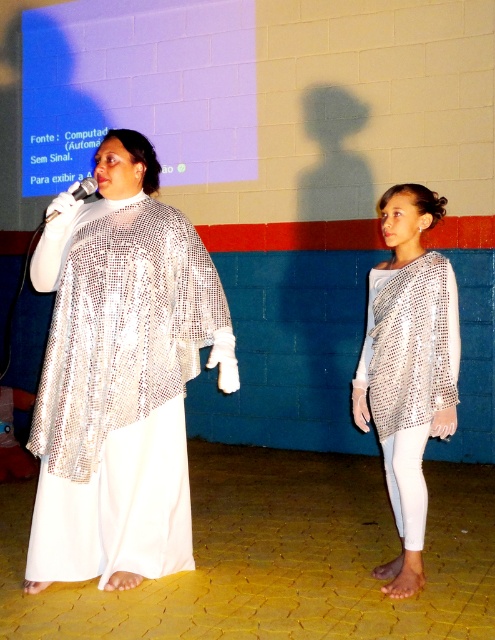
Is shiny metallic robe at left further to the viewer compared to silver mesh top at center?

No, shiny metallic robe at left is in front of silver mesh top at center.

Is shiny metallic robe at left thinner than silver mesh top at center?

No, shiny metallic robe at left is not thinner than silver mesh top at center.

Locate an element on the screen. shiny metallic robe at left is located at coordinates (x=119, y=388).

In order to click on shiny metallic robe at left in this screenshot , I will do `click(119, 388)`.